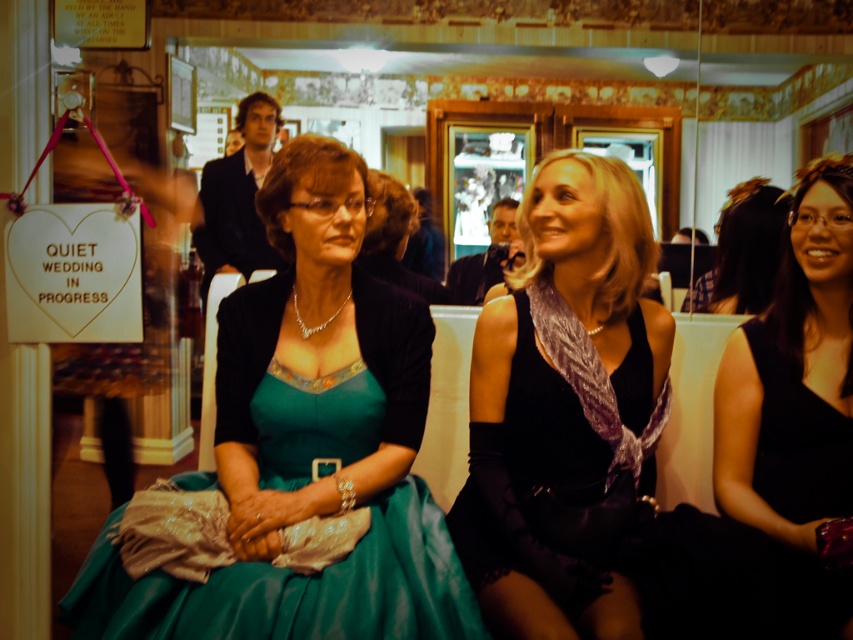
Is satin black dress at center wider than black satin dress at right?

Correct, the width of satin black dress at center exceeds that of black satin dress at right.

Can you confirm if satin black dress at center is positioned above black satin dress at right?

Incorrect, satin black dress at center is not positioned above black satin dress at right.

From the picture: Who is more distant from viewer, (601,636) or (822,253)?

Point (822,253)

What are the coordinates of `satin black dress at center` in the screenshot? It's located at (561, 400).

Is point (254, 404) positioned in front of point (849, 627)?

That is False.

Which is behind, point (297, 394) or point (843, 173)?

The point (843, 173) is behind.

Does point (351, 358) come closer to viewer compared to point (844, 234)?

No, it is not.

Where is `teal satin dress at center`? This screenshot has height=640, width=853. teal satin dress at center is located at coordinates (306, 445).

Is teal satin dress at center positioned at the back of satin black dress at center?

No, it is in front of satin black dress at center.

Is teal satin dress at center wider than satin black dress at center?

Yes.

Identify the location of teal satin dress at center. This screenshot has width=853, height=640. (306, 445).

Identify the location of teal satin dress at center. (306, 445).